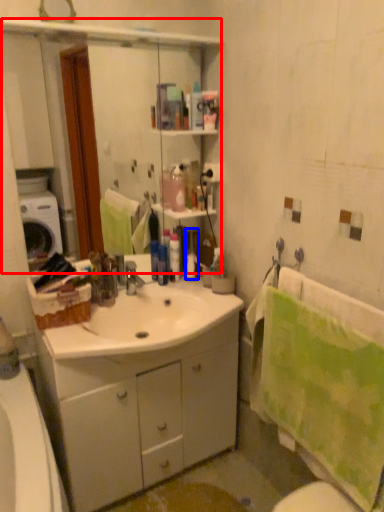
Question: Which point is closer to the camera, mirror (highlighted by a red box) or toiletry (highlighted by a blue box)?

Choices:
 (A) mirror
 (B) toiletry

Answer: (A)